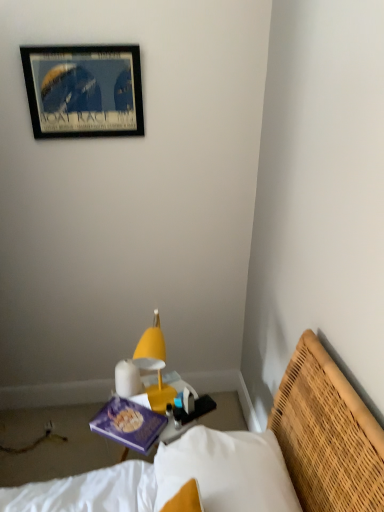
Question: From a real-world perspective, relative to purple matte book at center, is wooden framed poster at upper left vertically above or below?

Choices:
 (A) above
 (B) below

Answer: (A)

Question: Is wooden framed poster at upper left taller or shorter than purple matte book at center?

Choices:
 (A) tall
 (B) short

Answer: (A)

Question: Which object is positioned closest to the yellow plastic lamp at center?

Choices:
 (A) purple matte book at center
 (B) wooden framed poster at upper left
 (C) yellow woven bed at lower right

Answer: (A)

Question: Which is farther from the yellow woven bed at lower right?

Choices:
 (A) yellow plastic lamp at center
 (B) wooden framed poster at upper left
 (C) purple matte book at center

Answer: (B)